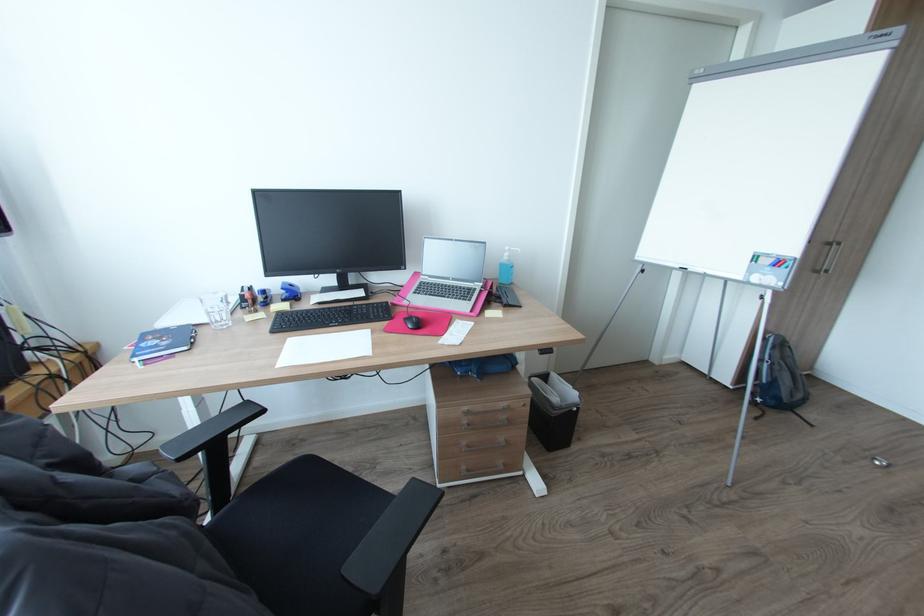
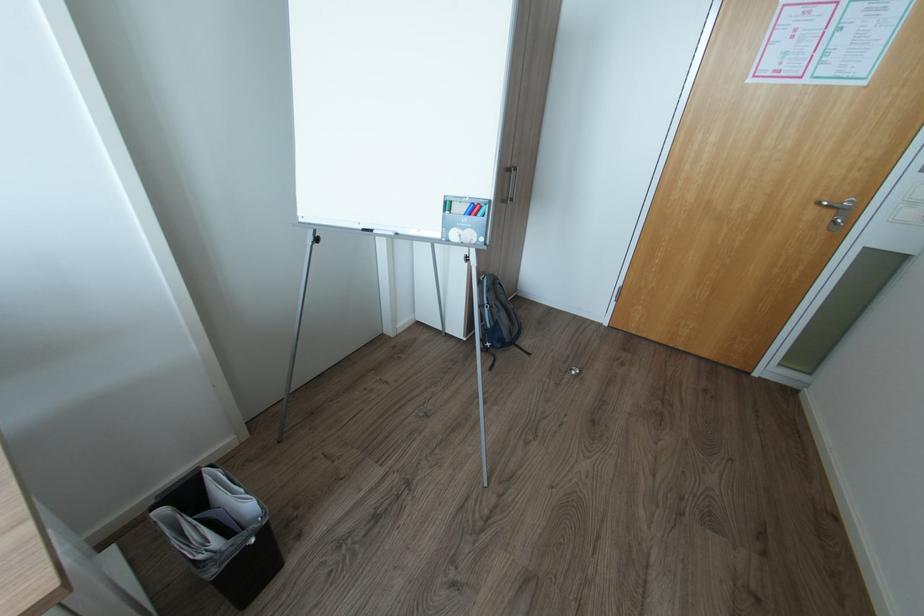
In the second image, find the point that corresponds to (763,399) in the first image.

(492, 344)